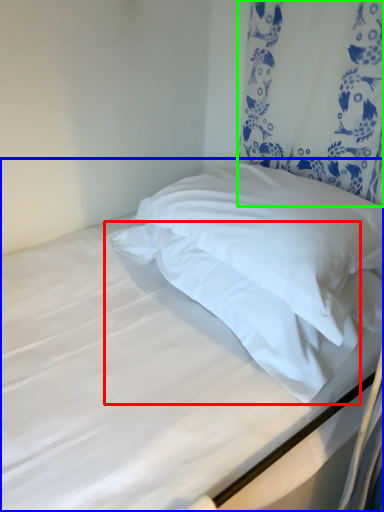
Question: Considering the real-world distances, which object is closest to pillow (highlighted by a red box)? bed (highlighted by a blue box) or curtain (highlighted by a green box).

Choices:
 (A) bed
 (B) curtain

Answer: (A)